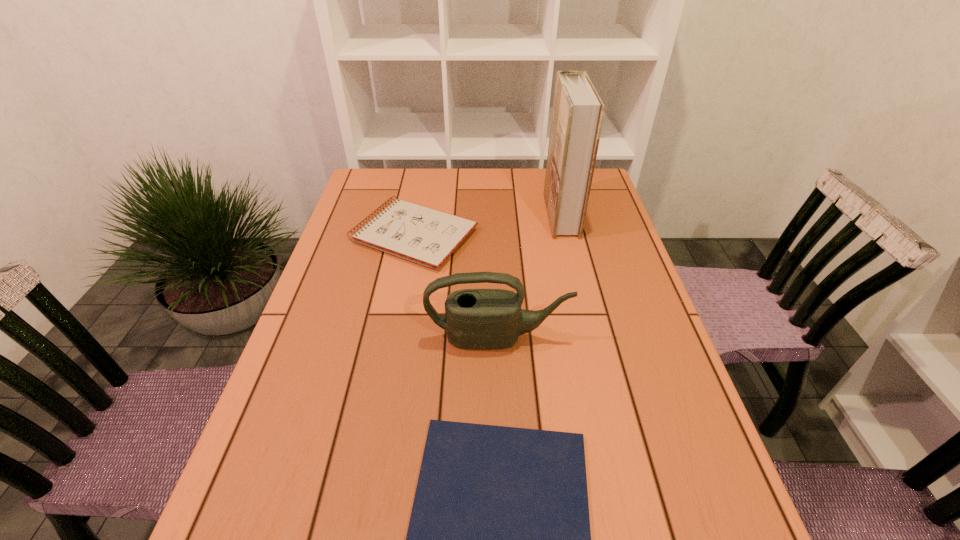
You are a GUI agent. You are given a task and a screenshot of the screen. Output one action in this format:
    pyautogui.click(x=<x>, y=<y>)
    Task: Click on the free space located 0.250m on the right of the farther notepad
    
    Given the screenshot: What is the action you would take?
    pyautogui.click(x=563, y=235)

This screenshot has height=540, width=960. In order to click on phonebook present at the far edge in this screenshot , I will do `click(578, 111)`.

Find the location of a particular element. Image resolution: width=960 pixels, height=540 pixels. notepad that is at the far edge is located at coordinates (426, 236).

Identify the location of object located at the left edge. The image size is (960, 540). (426, 236).

Where is `object located in the right edge section of the desktop`? The width and height of the screenshot is (960, 540). object located in the right edge section of the desktop is located at coordinates (578, 111).

Locate an element on the screen. This screenshot has width=960, height=540. object at the far left corner is located at coordinates (426, 236).

You are a GUI agent. You are given a task and a screenshot of the screen. Output one action in this format:
    pyautogui.click(x=<x>, y=<y>)
    Task: Click on the object that is at the far right corner
    
    Given the screenshot: What is the action you would take?
    pyautogui.click(x=578, y=111)

This screenshot has width=960, height=540. In the image, there is a desktop. Identify the location of free space at the far edge. (429, 174).

This screenshot has width=960, height=540. I want to click on vacant region at the left edge of the desktop, so click(370, 207).

I want to click on vacant point at the right edge, so click(x=626, y=327).